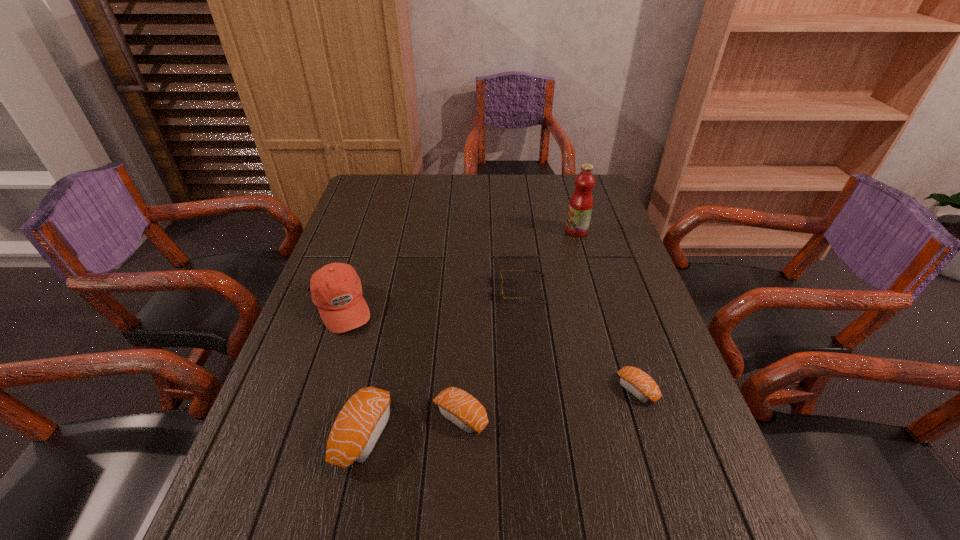
At what (x,y) coordinates should I click in order to perform the action: click on free location located on the back of the fourth tallest object. Please return your answer as a coordinate pair (x, y). The image size is (960, 540). Looking at the image, I should click on (465, 294).

Where is `free space located 0.090m on the back of the rightmost sushi`? free space located 0.090m on the back of the rightmost sushi is located at coordinates (622, 342).

Identify the location of free space located 0.080m on the right of the baseball cap. (403, 307).

Where is `free space located 0.350m on the front label of the tallest object`? The height and width of the screenshot is (540, 960). free space located 0.350m on the front label of the tallest object is located at coordinates (459, 231).

Identify the location of free spot located on the front label of the tallest object. (535, 231).

Find the location of a particular element. vacant space positioned on the front label of the tallest object is located at coordinates (456, 231).

I want to click on free space located 0.170m on the front-facing side of the sunglasses, so click(x=440, y=289).

Locate an element on the screen. The height and width of the screenshot is (540, 960). vacant space situated 0.390m on the front-facing side of the sunglasses is located at coordinates (361, 289).

The width and height of the screenshot is (960, 540). Identify the location of vacant space located 0.100m on the front-facing side of the sunglasses. (465, 289).

Identify the location of object that is at the near edge. This screenshot has width=960, height=540. (357, 428).